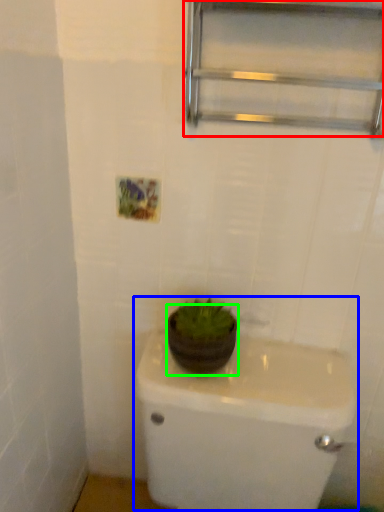
Question: Considering the real-world distances, which object is farthest from shelf (highlighted by a red box)? sink (highlighted by a blue box) or flowerpot (highlighted by a green box)?

Choices:
 (A) sink
 (B) flowerpot

Answer: (A)